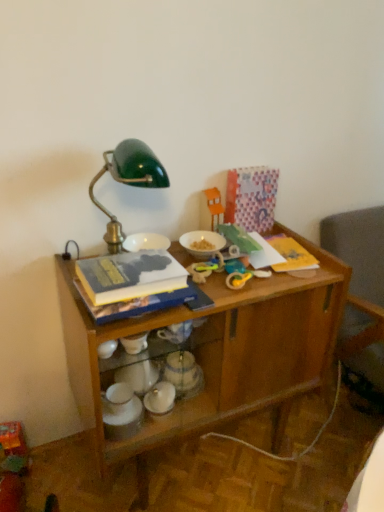
The width and height of the screenshot is (384, 512). Identify the location of free space to the left of yellow rubber toy at center, acting as the 3th toy starting from the back. (206, 287).